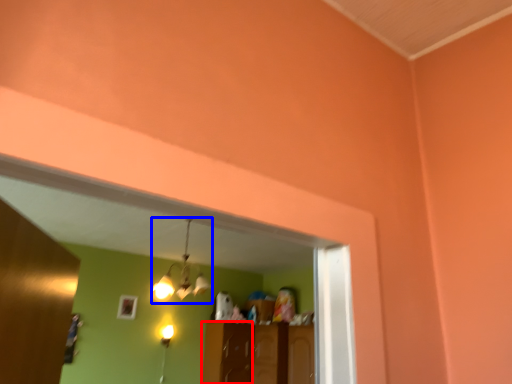
Question: Among these objects, which one is nearest to the camera, cabinetry (highlighted by a red box) or light fixture (highlighted by a blue box)?

Choices:
 (A) cabinetry
 (B) light fixture

Answer: (B)